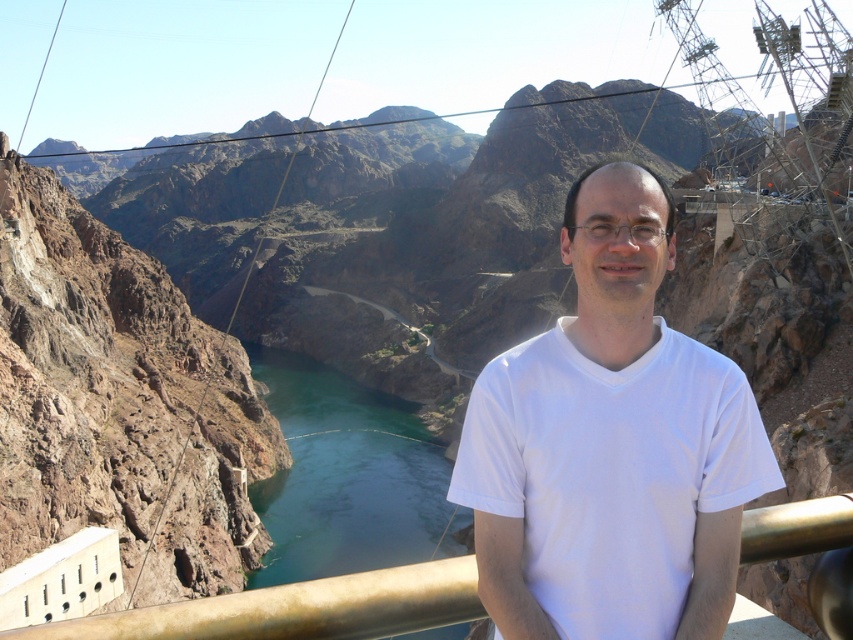
Which is more to the right, green smooth water at center or gold metallic railing at center?

Positioned to the right is gold metallic railing at center.

Which is below, green smooth water at center or gold metallic railing at center?

green smooth water at center is lower down.

Between point (300, 531) and point (328, 592), which one is positioned behind?

Point (300, 531)

Where is `green smooth water at center`? The image size is (853, 640). green smooth water at center is located at coordinates (344, 476).

Does point (729, 448) lie behind point (234, 609)?

That is True.

In order to click on white matte shirt at center in this screenshot , I will do `click(611, 445)`.

Is white matte shirt at center further to camera compared to green smooth water at center?

No, it is in front of green smooth water at center.

Does point (730, 602) come in front of point (363, 538)?

Yes, it is in front of point (363, 538).

Between point (660, 544) and point (283, 486), which one is positioned in front?

Positioned in front is point (660, 544).

Where is `white matte shirt at center`? The image size is (853, 640). white matte shirt at center is located at coordinates (611, 445).